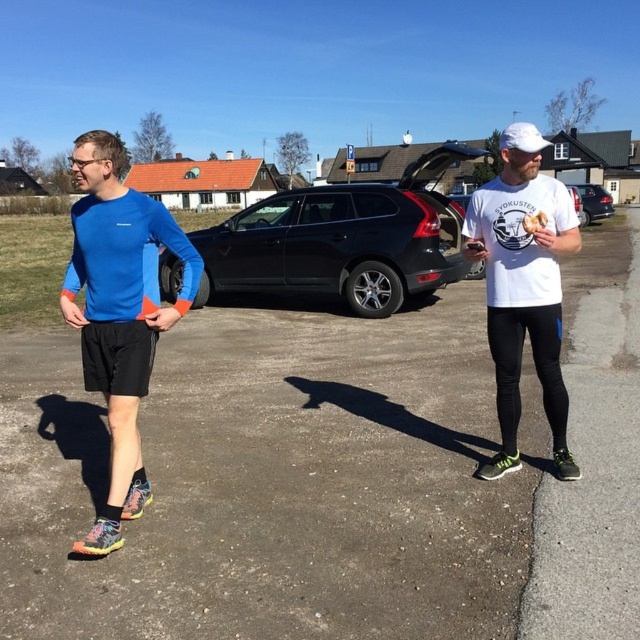
You are a delivery driver who needs to park your vehicle between the shiny black suv at center and the metallic silver hatchback at center. Your vehicle is 1.8 meters wide. Can you fit your vehicle between them?

The shiny black suv at center has a width less than the metallic silver hatchback at center. However, the exact distance between them isn not provided. Therefore, it is impossible to determine if your 1.8 meter wide vehicle can fit between them based on the given information.

You are a delivery driver who needs to park your van between the shiny black suv at center and the metallic silver hatchback at center. The van is 20 feet long. Is there enough space between the two vehicles to park your van?

The shiny black suv at center and metallic silver hatchback at center are 26.19 feet apart. Since the van is 20 feet long, there is enough space between the two vehicles to park the van.

From the picture: You are a photographer trying to capture a group photo of the blue matte running top at left and the shiny black suv at center. Given their sizes, which object should you position closer to the camera to ensure both appear proportionally sized in the photo?

Since the blue matte running top at left is wider than the shiny black suv at center, you should place the shiny black suv at center closer to the camera to balance their sizes in the photo.